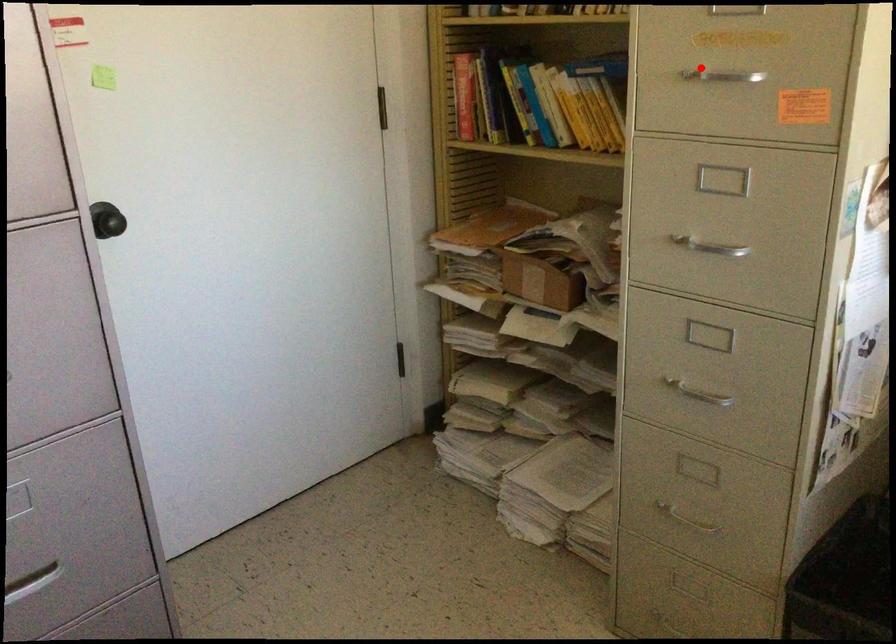
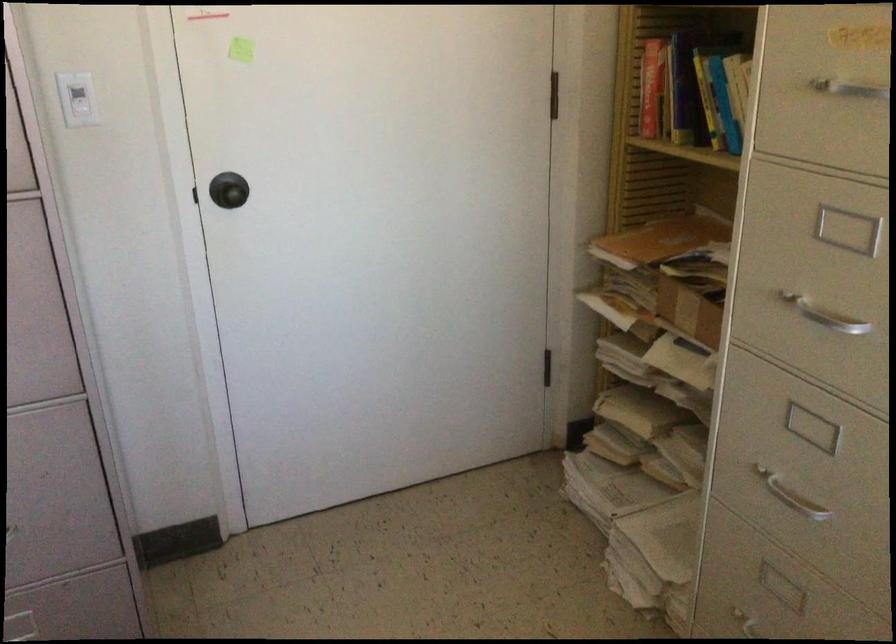
Question: I am providing you with two images of the same scene from different viewpoints. Image1 has a red point marked. In image2, the corresponding 3D location appears at what relative position? Reply with the corresponding letter.

Choices:
 (A) Closer
 (B) Farther

Answer: (A)